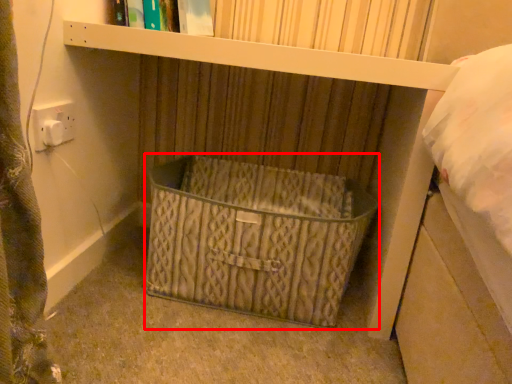
Question: From the image's perspective, where is basket (annotated by the red box) located in relation to book in the image?

Choices:
 (A) above
 (B) below

Answer: (B)